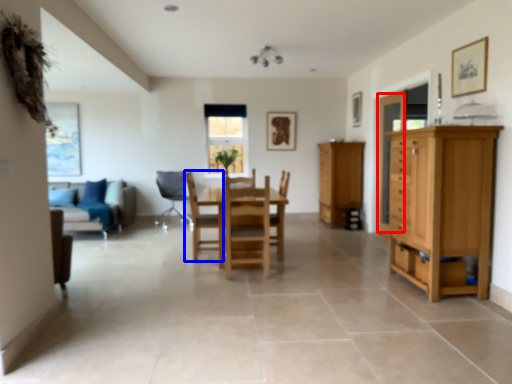
Question: Which object is further to the camera taking this photo, glass door (highlighted by a red box) or chair (highlighted by a blue box)?

Choices:
 (A) glass door
 (B) chair

Answer: (A)